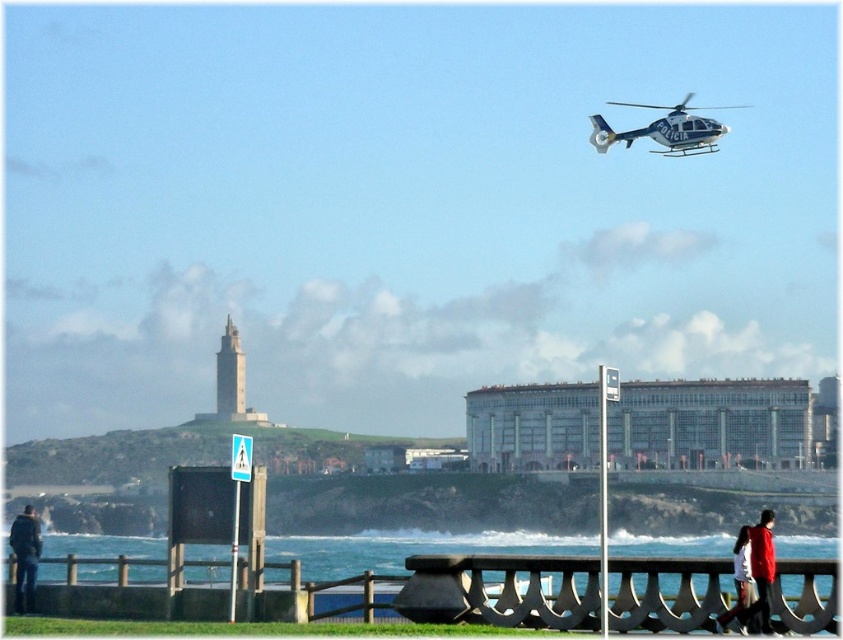
Question: Which of the following is the farthest from the observer?

Choices:
 (A) (31, 584)
 (B) (594, 125)
 (C) (760, 560)

Answer: (B)

Question: Can you confirm if blue metallic helicopter at upper right is smaller than dark blue jacket at lower left?

Choices:
 (A) no
 (B) yes

Answer: (B)

Question: Which of the following is the farthest from the observer?

Choices:
 (A) (15, 531)
 (B) (637, 106)
 (C) (760, 566)

Answer: (B)

Question: Which object is the closest to the dark blue jacket at lower left?

Choices:
 (A) red fabric jacket at lower right
 (B) blue metallic helicopter at upper right

Answer: (A)

Question: Considering the relative positions of red fabric jacket at lower right and dark blue jacket at lower left in the image provided, where is red fabric jacket at lower right located with respect to dark blue jacket at lower left?

Choices:
 (A) below
 (B) above

Answer: (B)

Question: Where is blue metallic helicopter at upper right located in relation to dark blue jacket at lower left in the image?

Choices:
 (A) right
 (B) left

Answer: (A)